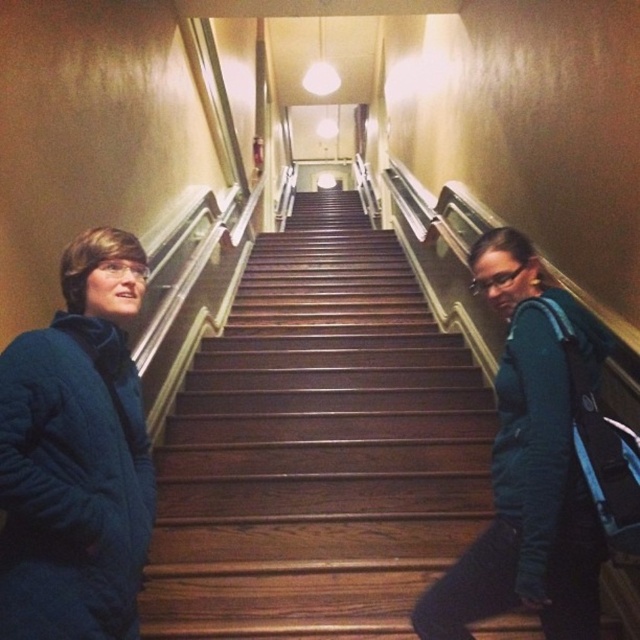
You are a delivery person holding a package that requires a 4 feet clearance to carry through. You need to walk between the blue puffy jacket at left and the blue fleece jacket at left. Is there enough space for you to pass through without bending?

The distance between the blue puffy jacket at left and the blue fleece jacket at left is 3.64 feet, which is less than the required 4 feet clearance. Therefore, you would need to bend or adjust your path to navigate the space.

You are trying to determine if the brown wooden stairs at center can fit entirely within the space occupied by the blue puffy jacket at left in the image. Based on the scene description, can they?

The brown wooden stairs at center occupies less space than blue puffy jacket at left, so yes, the stairs can fit entirely within the space occupied by the blue puffy jacket at left.